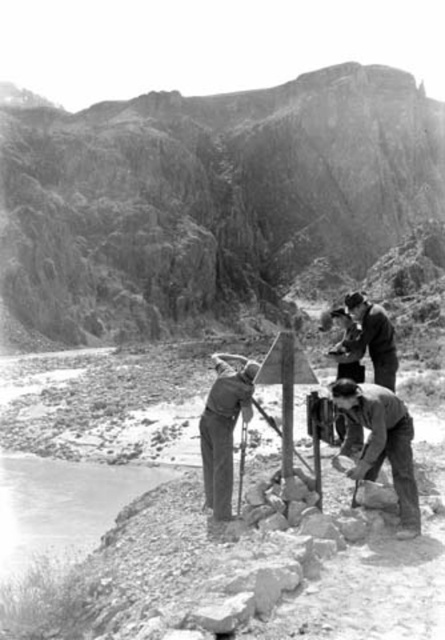
Question: Which of these objects is positioned farthest from the dark gray fabric shirt at lower right?

Choices:
 (A) smooth rock river at lower left
 (B) metallic pole at center
 (C) metallic signpost at center

Answer: (A)

Question: From the image, what is the correct spatial relationship of smooth gray pants at center in relation to metallic signpost at center?

Choices:
 (A) above
 (B) below

Answer: (A)

Question: Does smooth gray pants at center appear over metallic pole at center?

Choices:
 (A) no
 (B) yes

Answer: (A)

Question: Which point is farther to the camera?

Choices:
 (A) (393, 401)
 (B) (207, 410)
 (C) (288, 472)
 (D) (35, 579)

Answer: (B)

Question: Does dark gray fabric shirt at lower right have a greater width compared to metallic pole at center?

Choices:
 (A) yes
 (B) no

Answer: (A)

Question: Which object appears closest to the camera in this image?

Choices:
 (A) metallic pole at center
 (B) smooth gray pants at center
 (C) metallic signpost at center

Answer: (A)